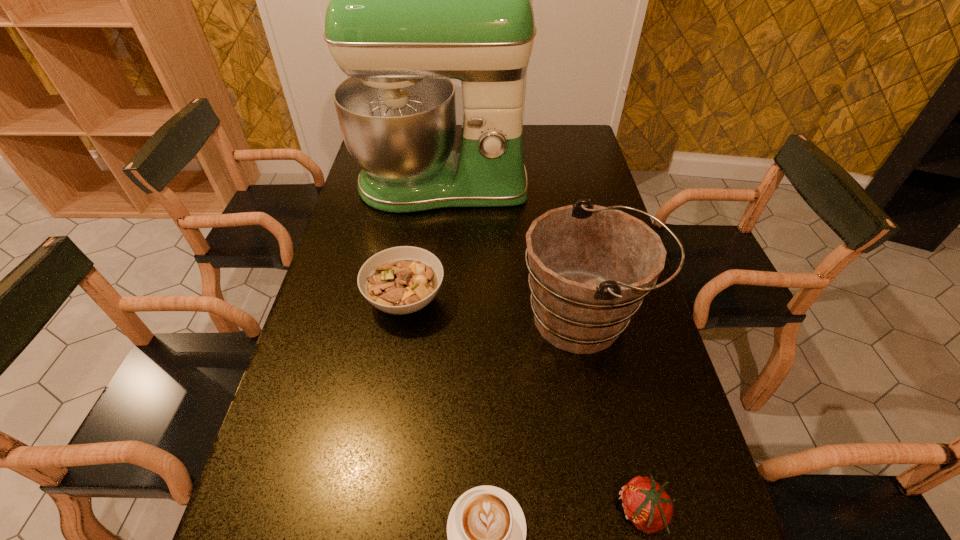
At what (x,y) coordinates should I click in order to perform the action: click on free region at the right edge of the desktop. Please return your answer as a coordinate pair (x, y). Image resolution: width=960 pixels, height=540 pixels. Looking at the image, I should click on (586, 177).

Where is `vacant region at the far right corner of the desktop`? vacant region at the far right corner of the desktop is located at coordinates (576, 147).

Identify the location of free space between the stew and the mixer. (423, 242).

Locate an element on the screen. This screenshot has width=960, height=540. free space between the farthest object and the fourth shortest object is located at coordinates (513, 252).

The width and height of the screenshot is (960, 540). In order to click on vacant area that lies between the farthest object and the stew in this screenshot , I will do `click(423, 242)`.

The width and height of the screenshot is (960, 540). Find the location of `the fourth closest object relative to the shortest object`. the fourth closest object relative to the shortest object is located at coordinates (416, 0).

Choose which object is the fourth nearest neighbor to the tallest object. Please provide its 2D coordinates. Your answer should be formatted as a tuple, i.e. [(x, y)], where the tuple contains the x and y coordinates of a point satisfying the conditions above.

[(486, 529)]